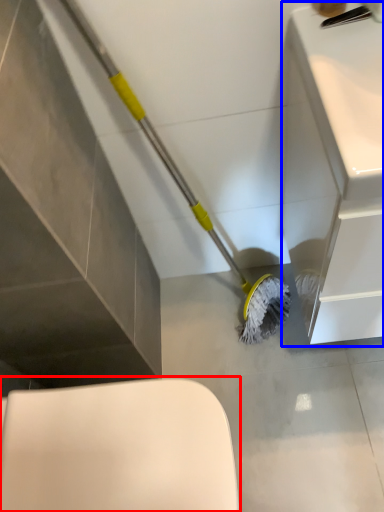
Question: Among these objects, which one is nearest to the camera, toilet (highlighted by a red box) or counter top (highlighted by a blue box)?

Choices:
 (A) toilet
 (B) counter top

Answer: (B)